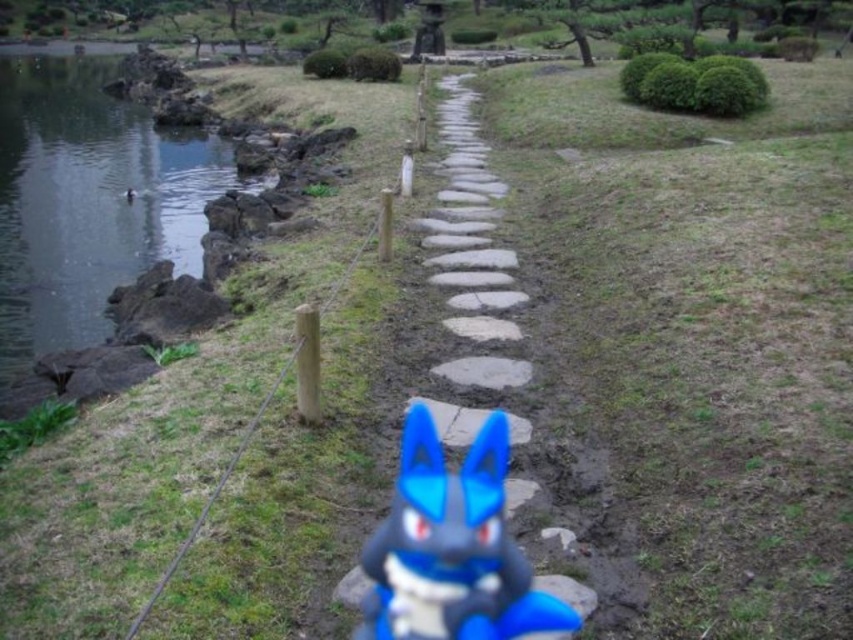
You are standing at the entrance of the Japanese garden and want to reach the wooden fence bordering the smooth stone path at center. Which direction should you walk to get closer to the fence?

You should walk backward because the smooth stone path at center is located at point [453,541], which is near the center of the image, so the wooden fence would be behind you relative to your starting position at the entrance.

From the picture: You are standing at the stone pathway in the Japanese garden and want to walk towards the two points marked in the image. Which point, point (x=22, y=161) or point (x=375, y=529), will you reach first?

You will reach point (x=22, y=161) first because it is closer to you than point (x=375, y=529), which is further away.

You are standing at the starting point of the stone pathway in the Japanese garden. You notice two points marked in the scene. The first point is at coordinates point [64,65] and the second point is at point [440,476]. Which of these two points is closer to you?

Point [64,65] is further to the camera than point [440,476], so the point closer to you is point [440,476].